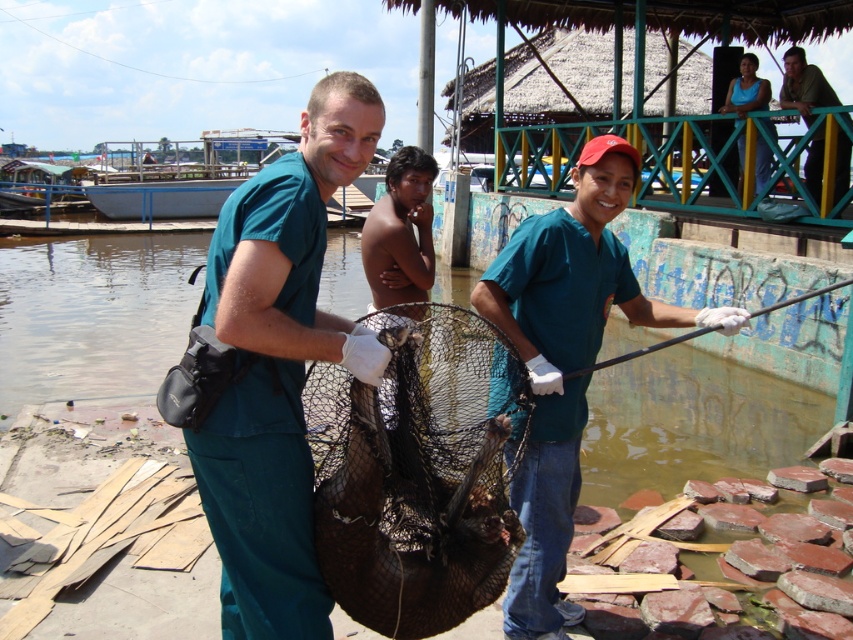
Can you confirm if dark skin/rough skin boy at center is thinner than black metal fishing pole at right?

No, dark skin/rough skin boy at center is not thinner than black metal fishing pole at right.

Who is more distant from viewer, (369,260) or (647,352)?

Point (369,260)

The image size is (853, 640). I want to click on dark skin/rough skin boy at center, so click(399, 232).

Can you confirm if clear water at center is shorter than black mesh net at center?

Incorrect, clear water at center's height does not fall short of black mesh net at center's.

Is clear water at center wider than black mesh net at center?

Yes, clear water at center is wider than black mesh net at center.

Between point (91, 374) and point (390, 340), which one is positioned behind?

Positioned behind is point (91, 374).

I want to click on clear water at center, so click(91, 316).

Between teal scrubs at center and black mesh net at center, which one has more height?

teal scrubs at center

Between point (352, 342) and point (369, 412), which one is positioned in front?

Point (352, 342)

Describe the element at coordinates (279, 365) in the screenshot. I see `teal scrubs at center` at that location.

At what (x,y) coordinates should I click in order to perform the action: click on teal scrubs at center. Please return your answer as a coordinate pair (x, y). The height and width of the screenshot is (640, 853). Looking at the image, I should click on (279, 365).